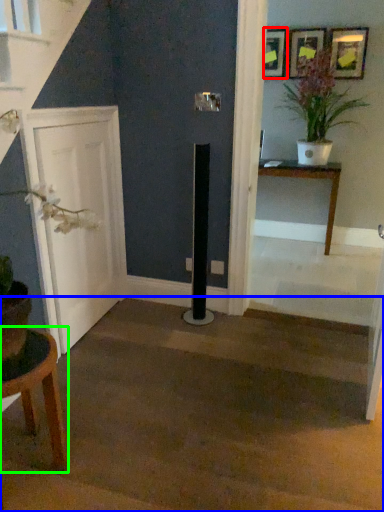
Question: Which is nearer to the picture frame (highlighted by a red box)? stairwell (highlighted by a blue box) or table (highlighted by a green box).

Choices:
 (A) stairwell
 (B) table

Answer: (A)